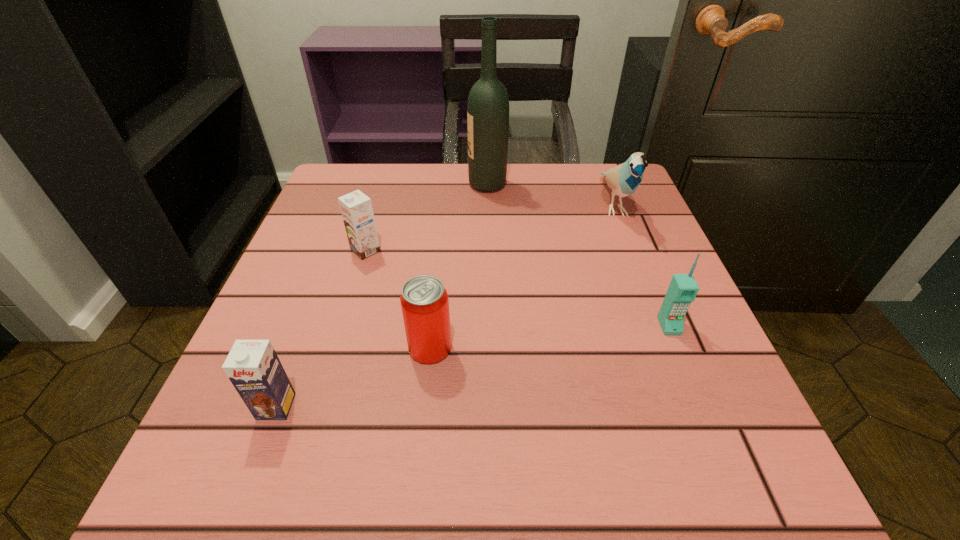
Locate an element on the screen. This screenshot has width=960, height=540. the tallest object is located at coordinates (488, 104).

Where is `the fourth object from left to right`? This screenshot has width=960, height=540. the fourth object from left to right is located at coordinates (488, 104).

Locate an element on the screen. The height and width of the screenshot is (540, 960). the fifth shortest object is located at coordinates pos(624,179).

Identify the location of cellular telephone. (683, 288).

I want to click on can, so click(x=424, y=301).

This screenshot has width=960, height=540. I want to click on the farther chocolate milk, so click(x=356, y=208).

Locate an element on the screen. the right chocolate milk is located at coordinates (356, 208).

At what (x,y) coordinates should I click in order to perform the action: click on the nearest object. Please return your answer as a coordinate pair (x, y). Looking at the image, I should click on (253, 367).

This screenshot has width=960, height=540. In order to click on the leftmost object in this screenshot , I will do `click(253, 367)`.

Where is `vacant position located 0.240m on the labeled side of the wine bottle`? vacant position located 0.240m on the labeled side of the wine bottle is located at coordinates pos(369,185).